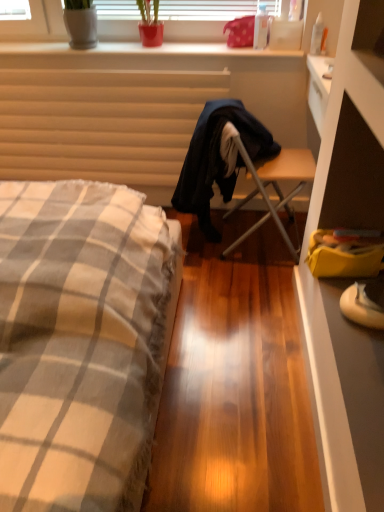
Locate an element on the screen. empty space that is ontop of smooth white surface at upper center (from a real-world perspective) is located at coordinates (144, 42).